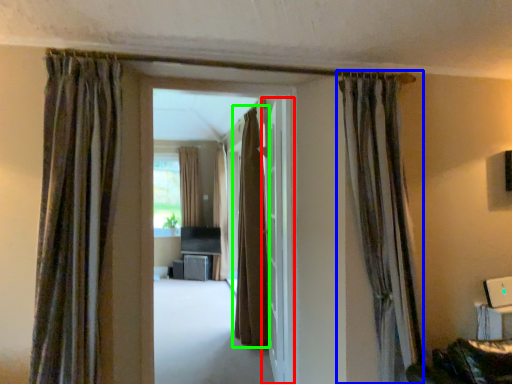
Question: Considering the real-world distances, which object is closest to door (highlighted by a red box)? curtain (highlighted by a blue box) or curtain (highlighted by a green box).

Choices:
 (A) curtain
 (B) curtain

Answer: (B)